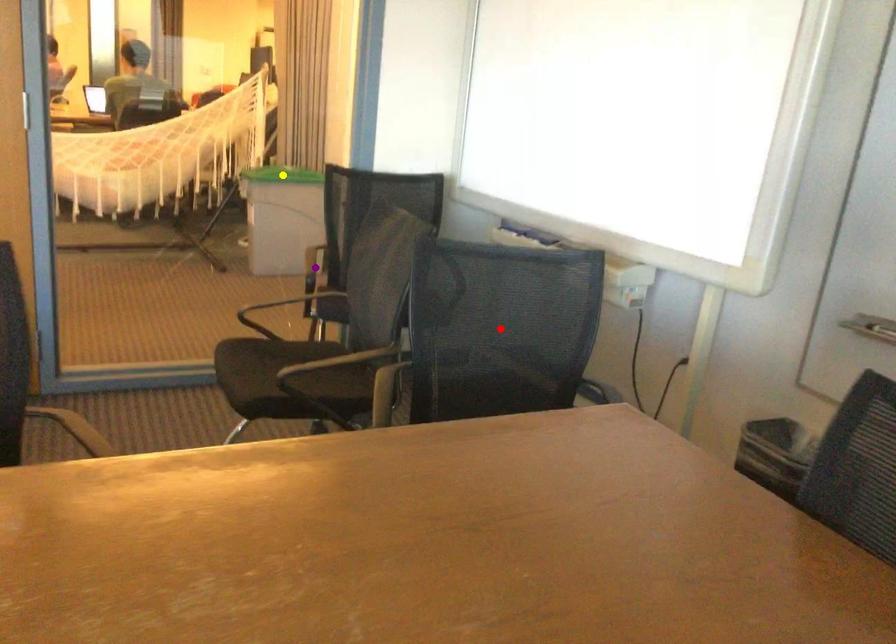
Order these from nearest to farthest:
A) yellow point
B) purple point
C) red point

red point → purple point → yellow point